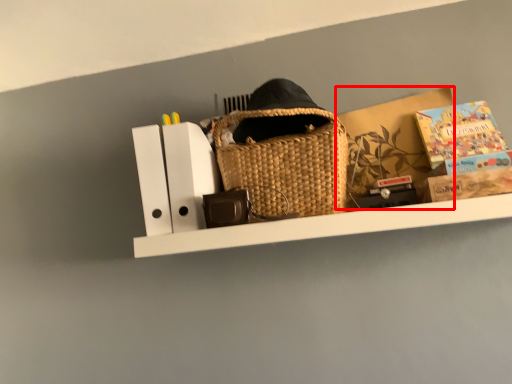
Question: From the image's perspective, where is cardboard box (annotated by the red box) located in relation to paperback book in the image?

Choices:
 (A) below
 (B) above

Answer: (A)